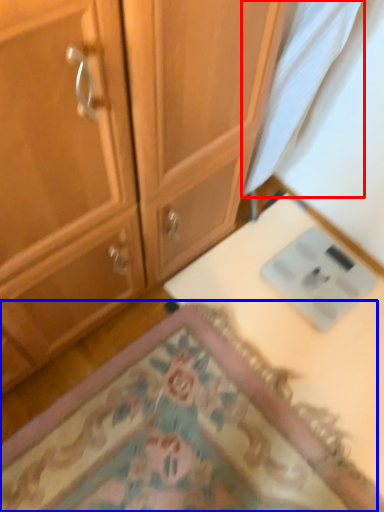
Question: Which object is further to the camera taking this photo, fabric (highlighted by a red box) or mat (highlighted by a blue box)?

Choices:
 (A) fabric
 (B) mat

Answer: (B)